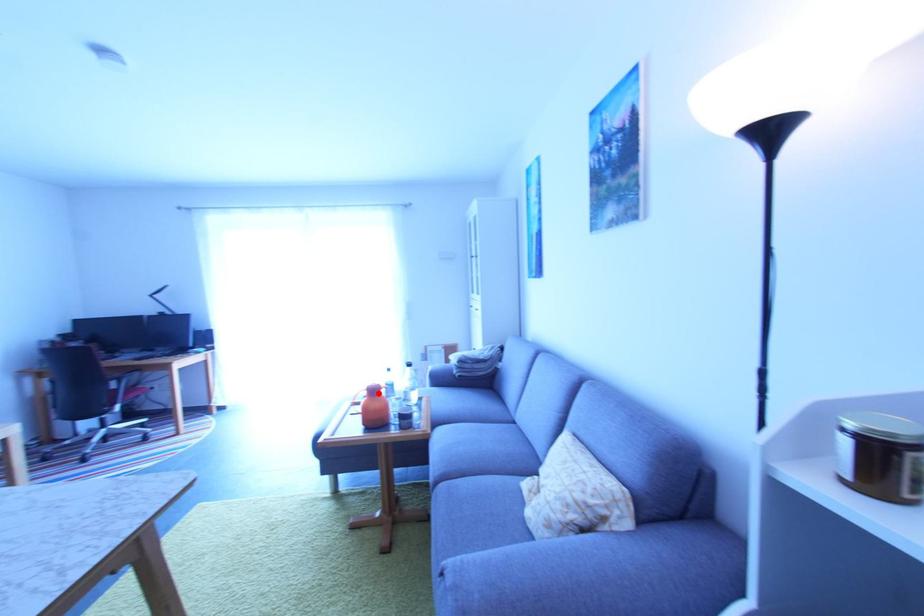
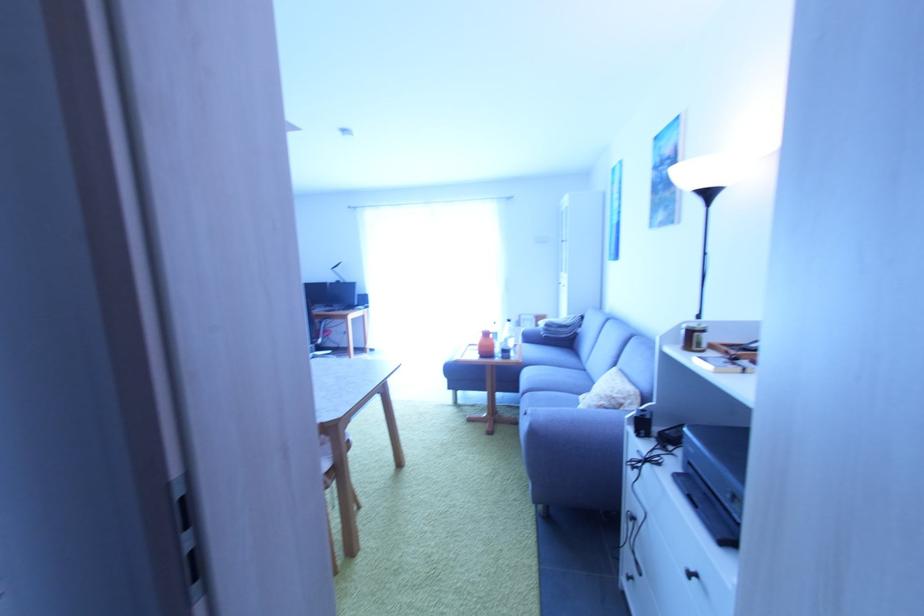
Find the pixel in the second image that matches the highlighted location in the first image.

(492, 336)